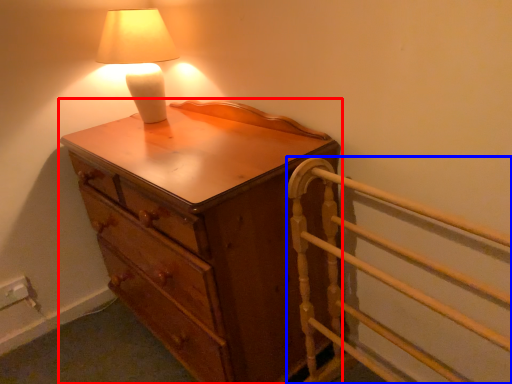
Question: Which point is closer to the camera, chest of drawers (highlighted by a red box) or bed frame (highlighted by a blue box)?

Choices:
 (A) chest of drawers
 (B) bed frame

Answer: (B)